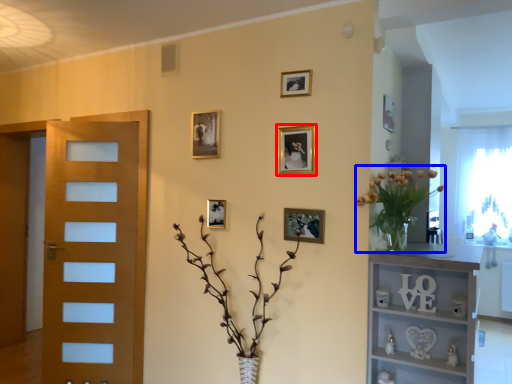
Question: Which object appears closest to the camera in this image, picture frame (highlighted by a red box) or floral arrangement (highlighted by a blue box)?

Choices:
 (A) picture frame
 (B) floral arrangement

Answer: (B)